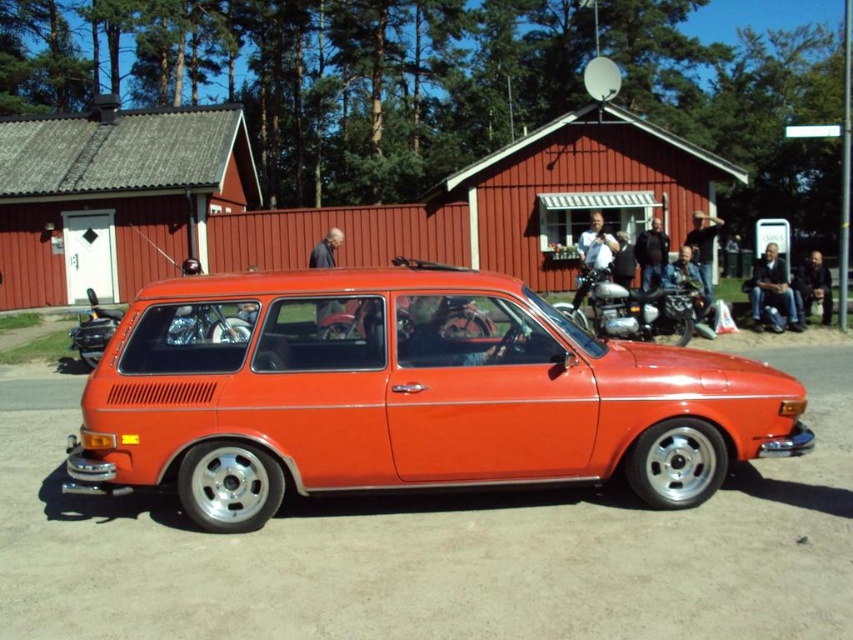
Where is `black leather jacket at center`? The height and width of the screenshot is (640, 853). black leather jacket at center is located at coordinates (651, 253).

Who is more forward, (657, 240) or (705, 284)?

Positioned in front is point (705, 284).

This screenshot has width=853, height=640. Identify the location of black leather jacket at center. (651, 253).

Is glossy orange station wagon at center to the left of dark gray fabric jacket at lower right from the viewer's perspective?

Correct, you'll find glossy orange station wagon at center to the left of dark gray fabric jacket at lower right.

Does point (323, 392) come farther from viewer compared to point (791, 280)?

No, it is not.

Is point (374, 330) less distant than point (815, 276)?

Yes, point (374, 330) is closer to viewer.

The width and height of the screenshot is (853, 640). Identify the location of glossy orange station wagon at center. (405, 394).

Does glossy orange station wagon at center have a lesser height compared to dark blue jeans at right?

No.

Does glossy orange station wagon at center appear under dark blue jeans at right?

Indeed, glossy orange station wagon at center is positioned under dark blue jeans at right.

What do you see at coordinates (405, 394) in the screenshot?
I see `glossy orange station wagon at center` at bounding box center [405, 394].

Find the location of a particular element. glossy orange station wagon at center is located at coordinates (405, 394).